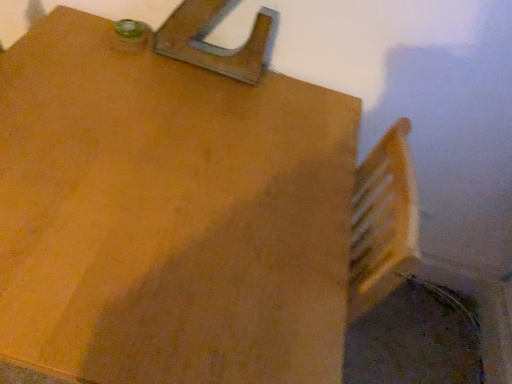
Locate an element on the screen. The height and width of the screenshot is (384, 512). vacant area that lies to the right of wooden at upper center is located at coordinates (280, 97).